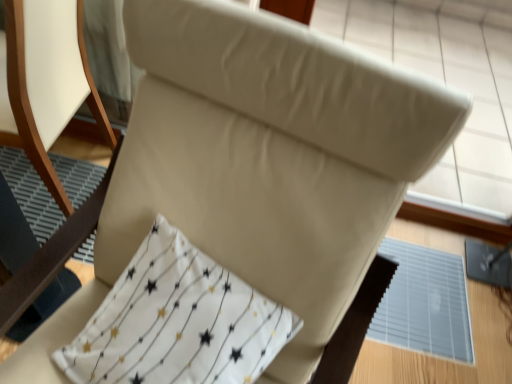
At what (x,y) coordinates should I click in order to perform the action: click on white fabric pillow at center. Please return your answer as a coordinate pair (x, y). Looking at the image, I should click on (177, 322).

This screenshot has width=512, height=384. What do you see at coordinates (177, 322) in the screenshot? I see `white fabric pillow at center` at bounding box center [177, 322].

In order to click on white fabric pillow at center in this screenshot , I will do 177,322.